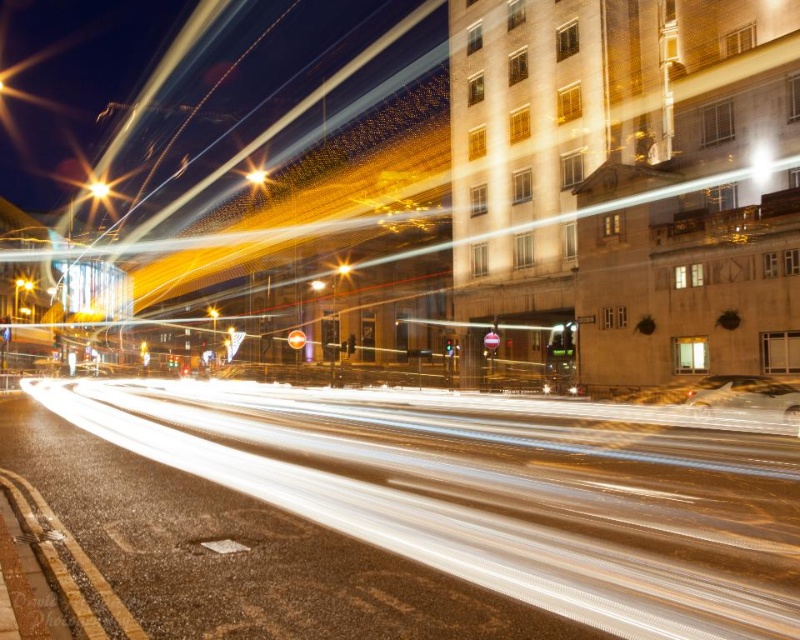
You are a photographer standing in the middle of the road, looking at the bright yellow light at upper left and the bright yellow streetlight at center. Which one appears taller in the photo?

The bright yellow light at upper left appears taller than the bright yellow streetlight at center because it has a greater height compared to the latter.

You are a photographer standing in the middle of the road, looking at the two bright yellow lights in the image. Which one appears closer to you, the bright yellow light at upper left or the bright yellow light at upper center?

The bright yellow light at upper left appears closer to you because the bright yellow light at upper center is behind it.